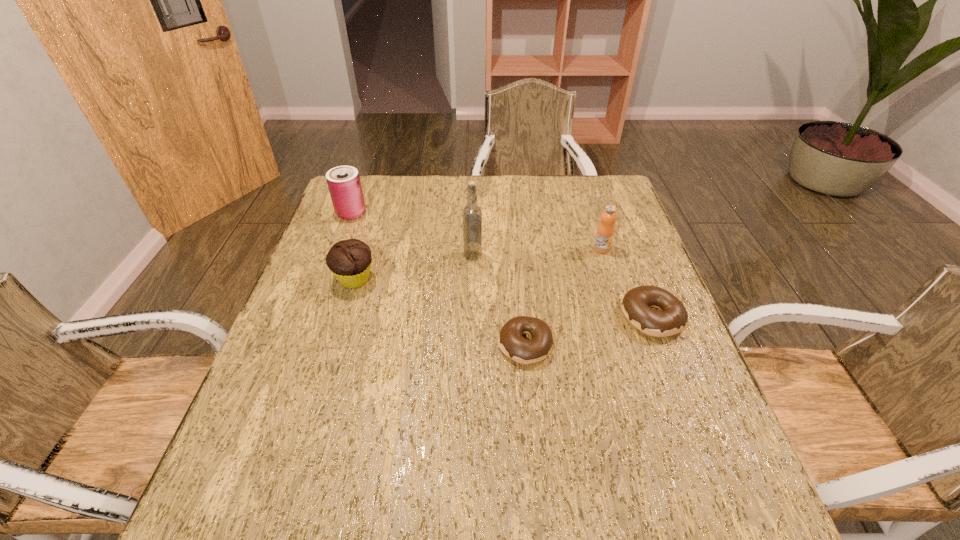
This screenshot has width=960, height=540. Identify the location of vacant space located 0.070m on the back of the right doughnut. click(x=636, y=276).

This screenshot has width=960, height=540. What are the coordinates of `vacant space located 0.100m on the back of the farthest object` in the screenshot? It's located at (360, 187).

In order to click on vacant space situated 0.200m on the front label of the orange juice in this screenshot , I will do `click(620, 307)`.

Where is `vacant area situated on the label of the vodka`? The width and height of the screenshot is (960, 540). vacant area situated on the label of the vodka is located at coordinates (533, 256).

What are the coordinates of `vacant position located 0.070m on the right of the third shortest object` in the screenshot? It's located at (403, 279).

At what (x,y) coordinates should I click in order to perform the action: click on object that is at the far edge. Please return your answer as a coordinate pair (x, y). Looking at the image, I should click on (344, 184).

The image size is (960, 540). In order to click on can that is at the left edge in this screenshot , I will do tap(344, 184).

The image size is (960, 540). I want to click on muffin that is at the left edge, so click(x=349, y=260).

Where is `doughnut that is positioned at the right edge`? The width and height of the screenshot is (960, 540). doughnut that is positioned at the right edge is located at coordinates (636, 303).

You are a GUI agent. You are given a task and a screenshot of the screen. Output one action in this format:
    pyautogui.click(x=<x>, y=<y>)
    Task: Click on the orange juice that is at the right edge
    The image size is (960, 540).
    Given the screenshot: What is the action you would take?
    pos(605,231)